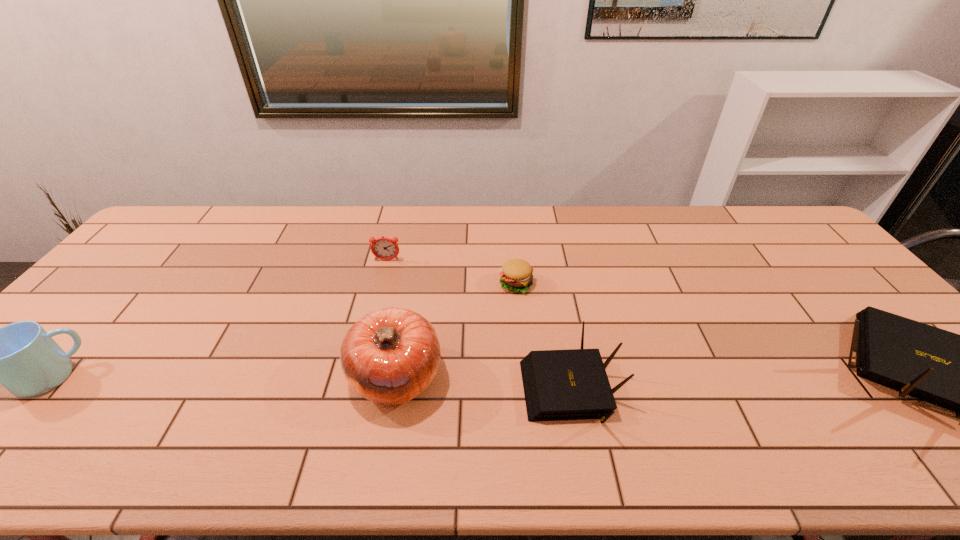
The width and height of the screenshot is (960, 540). Identify the location of object that stands as the closest to the shortest object. (572, 384).

Locate an element on the screen. free point that satisfies the following two spatial constraints: 1. on the front-facing side of the alarm clock; 2. on the left side of the left router is located at coordinates (354, 389).

Locate an element on the screen. free location that satisfies the following two spatial constraints: 1. on the front-facing side of the farthest object; 2. on the right side of the pumpkin is located at coordinates point(357,376).